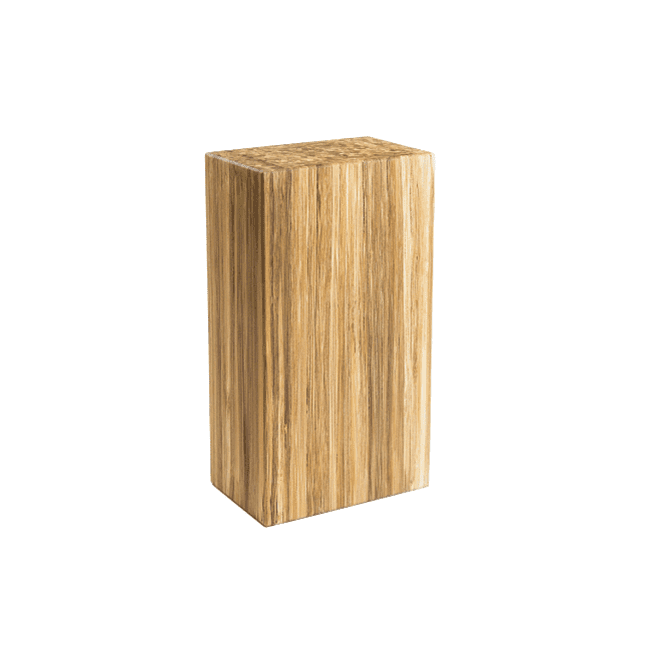
You are a GUI agent. You are given a task and a screenshot of the screen. Output one action in this format:
    pyautogui.click(x=<x>, y=<y>)
    Task: Click on the top of butcher block
    The image size is (660, 660).
    Given the screenshot: What is the action you would take?
    pyautogui.click(x=335, y=152)